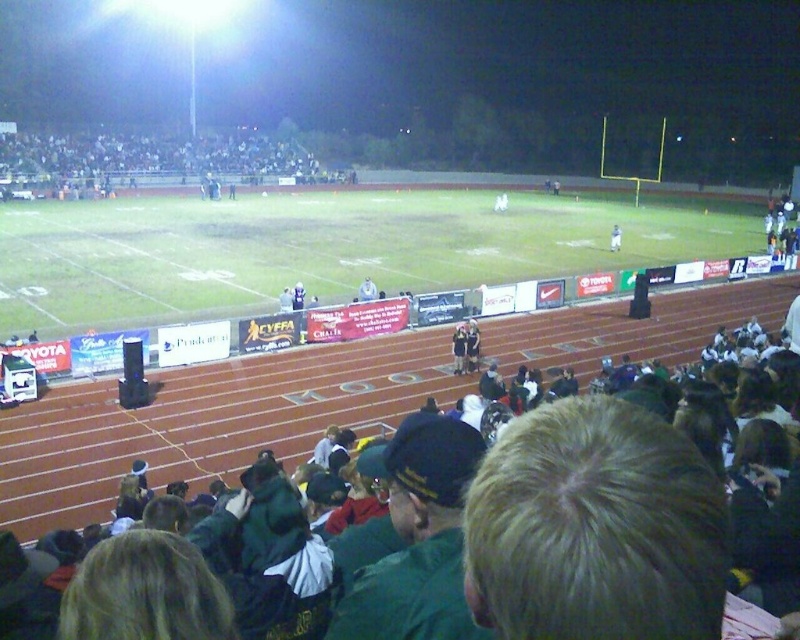
Question: Among these points, which one is farthest from the camera?

Choices:
 (A) (244, 164)
 (B) (433, 620)
 (C) (620, 228)
 (D) (682, 500)

Answer: (A)

Question: Is dark gray stadium seats at upper left further to the viewer compared to white plastic bag at center?

Choices:
 (A) no
 (B) yes

Answer: (B)

Question: Which object is positioned farthest from the dark gray stadium seats at upper left?

Choices:
 (A) dark green jacket at lower center
 (B) blonde hair at lower right
 (C) white plastic bag at center

Answer: (A)

Question: Estimate the real-world distances between objects in this image. Which object is farther from the dark green jacket at lower center?

Choices:
 (A) dark gray stadium seats at upper left
 (B) blonde hair at lower right

Answer: (A)

Question: Does dark green jacket at lower center lie in front of white plastic bag at center?

Choices:
 (A) yes
 (B) no

Answer: (A)

Question: Does blonde hair at lower right appear over dark gray stadium seats at upper left?

Choices:
 (A) yes
 (B) no

Answer: (B)